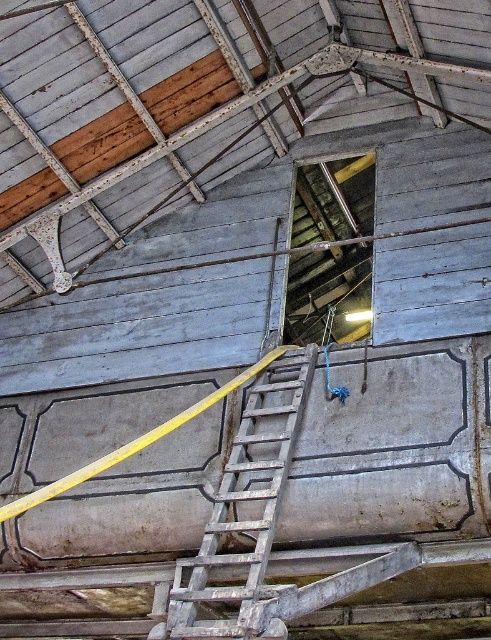
Can you confirm if rusty metal roof at upper center is shorter than wooden ladder at center?

In fact, rusty metal roof at upper center may be taller than wooden ladder at center.

Between rusty metal roof at upper center and wooden ladder at center, which one is positioned higher?

rusty metal roof at upper center is above.

Measure the distance between rusty metal roof at upper center and camera.

rusty metal roof at upper center and camera are 32.89 feet apart.

This screenshot has width=491, height=640. What are the coordinates of `rusty metal roof at upper center` in the screenshot? It's located at (193, 99).

Between wooden ladder at center and wooden at upper center, which one is positioned lower?

Positioned lower is wooden ladder at center.

Is point (261, 538) farther from camera compared to point (300, 205)?

No, (261, 538) is closer to viewer.

Between point (252, 588) and point (294, 292), which one is positioned in front?

Point (252, 588) is more forward.

This screenshot has height=640, width=491. In order to click on wooden ladder at center in this screenshot , I will do `click(244, 512)`.

From the picture: Is rusty metal roof at upper center above wooden at upper center?

Yes.

Is rusty metal roof at upper center to the right of wooden at upper center from the viewer's perspective?

In fact, rusty metal roof at upper center is to the left of wooden at upper center.

Is point (435, 115) farther from viewer compared to point (305, 264)?

No, (435, 115) is closer to viewer.

Identify the location of rusty metal roof at upper center. click(x=193, y=99).